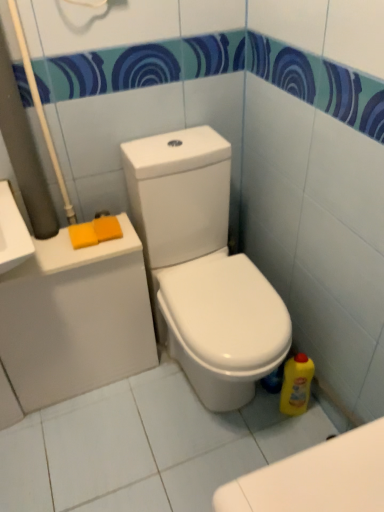
Question: Can you confirm if white glossy toilet at center is positioned to the right of orange sponge at upper left, which is the second soap in left-to-right order?

Choices:
 (A) no
 (B) yes

Answer: (B)

Question: Can you confirm if white glossy toilet at center is taller than orange sponge at upper left, which is the second soap in left-to-right order?

Choices:
 (A) yes
 (B) no

Answer: (A)

Question: From the image's perspective, is white glossy toilet at center above orange sponge at upper left, which is the second soap in left-to-right order?

Choices:
 (A) yes
 (B) no

Answer: (B)

Question: Is white glossy toilet at center thinner than orange sponge at upper left, which is the second soap in left-to-right order?

Choices:
 (A) no
 (B) yes

Answer: (A)

Question: Are white glossy toilet at center and orange sponge at upper left, which is the second soap in left-to-right order, far apart?

Choices:
 (A) yes
 (B) no

Answer: (B)

Question: Is orange sponge at left, the first soap in the left-to-right sequence, inside the boundaries of orange sponge at upper left, which is the second soap in left-to-right order, or outside?

Choices:
 (A) inside
 (B) outside

Answer: (B)

Question: From the image's perspective, is orange sponge at left, the first soap in the left-to-right sequence, positioned above or below orange sponge at upper left, which is the 1th soap from right to left?

Choices:
 (A) above
 (B) below

Answer: (B)

Question: From a real-world perspective, is orange sponge at left, the 2th soap positioned from the right, physically located above or below orange sponge at upper left, which is the second soap in left-to-right order?

Choices:
 (A) below
 (B) above

Answer: (A)

Question: Considering the positions of point (89, 223) and point (97, 224), is point (89, 223) closer or farther from the camera than point (97, 224)?

Choices:
 (A) farther
 (B) closer

Answer: (A)

Question: From the image's perspective, relative to orange sponge at left, the 2th soap positioned from the right, is white glossy toilet at center above or below?

Choices:
 (A) below
 (B) above

Answer: (A)

Question: Based on their positions, is white glossy toilet at center located to the left or right of orange sponge at left, the 2th soap positioned from the right?

Choices:
 (A) right
 (B) left

Answer: (A)

Question: Considering their positions, is white glossy toilet at center located in front of or behind orange sponge at left, the first soap in the left-to-right sequence?

Choices:
 (A) behind
 (B) front

Answer: (B)

Question: Is white glossy toilet at center bigger or smaller than orange sponge at left, the first soap in the left-to-right sequence?

Choices:
 (A) big
 (B) small

Answer: (A)

Question: Considering the positions of point (x=105, y=215) and point (x=288, y=367), is point (x=105, y=215) closer or farther from the camera than point (x=288, y=367)?

Choices:
 (A) closer
 (B) farther

Answer: (B)

Question: In the image, is orange sponge at upper left, which is the second soap in left-to-right order, on the left side or the right side of yellow plastic bottle at lower right?

Choices:
 (A) left
 (B) right

Answer: (A)